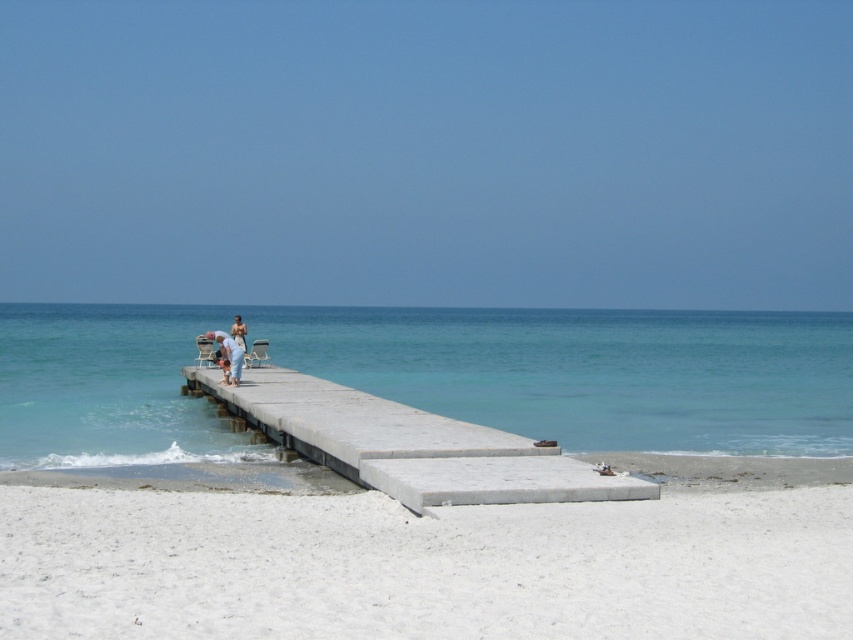
Question: Which point is farther to the camera?

Choices:
 (A) (780, 525)
 (B) (222, 332)

Answer: (B)

Question: Which object is positioned closest to the light blue denim jeans at center?

Choices:
 (A) concrete at center
 (B) clear blue water at center

Answer: (A)

Question: Can you confirm if clear blue water at center is positioned to the right of metallic silver beach chair at center?

Choices:
 (A) no
 (B) yes

Answer: (A)

Question: Which of the following is the closest to the observer?

Choices:
 (A) white sandy beach at lower center
 (B) metallic silver beach chair at center

Answer: (A)

Question: Does clear blue water at center appear over beige fabric beach chair at center?

Choices:
 (A) no
 (B) yes

Answer: (B)

Question: Is concrete at center to the left of metallic silver beach chair at center from the viewer's perspective?

Choices:
 (A) no
 (B) yes

Answer: (A)